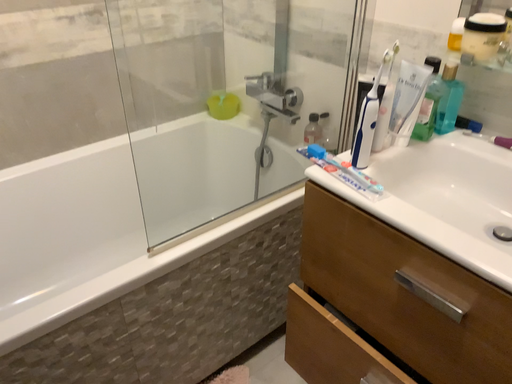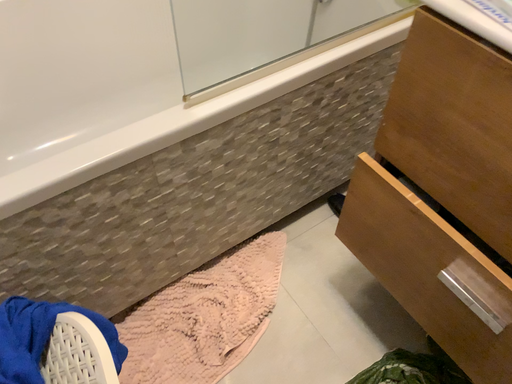
Question: Which way did the camera rotate in the video?

Choices:
 (A) rotated downward
 (B) rotated upward

Answer: (A)